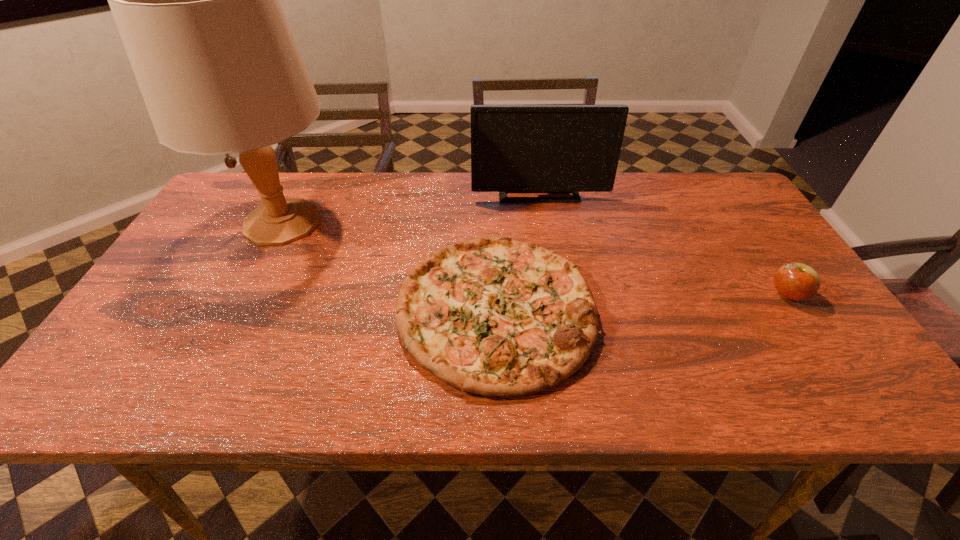
I want to click on computer monitor at the far edge, so click(x=514, y=148).

Image resolution: width=960 pixels, height=540 pixels. In order to click on object that is positioned at the near edge in this screenshot , I will do (493, 316).

At what (x,y) coordinates should I click in order to perform the action: click on object that is at the left edge. Please return your answer as a coordinate pair (x, y). Looking at the image, I should click on (196, 1).

Where is `object that is at the right edge`? The height and width of the screenshot is (540, 960). object that is at the right edge is located at coordinates (797, 281).

Where is `object located at the far left corner`? object located at the far left corner is located at coordinates (196, 1).

Find the location of a particular element. The height and width of the screenshot is (540, 960). vacant space at the far edge of the desktop is located at coordinates (445, 177).

Identify the location of vacant region at the near edge of the desktop. (775, 387).

Where is `vacant space at the left edge of the desktop`? Image resolution: width=960 pixels, height=540 pixels. vacant space at the left edge of the desktop is located at coordinates (205, 301).

Identify the location of free space at the right edge. (737, 282).

In the image, there is a desktop. Where is `free space at the far left corner`? The image size is (960, 540). free space at the far left corner is located at coordinates (246, 179).